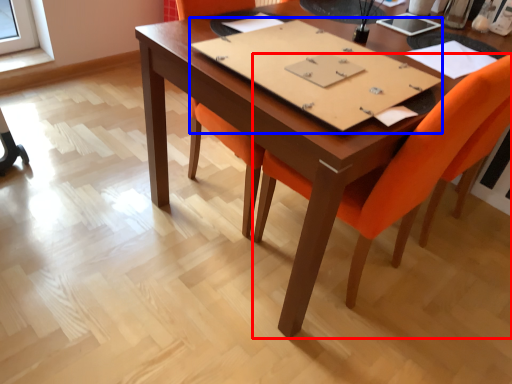
Question: Which object appears closest to the camera in this image, chair (highlighted by a red box) or notebook (highlighted by a blue box)?

Choices:
 (A) chair
 (B) notebook

Answer: (A)